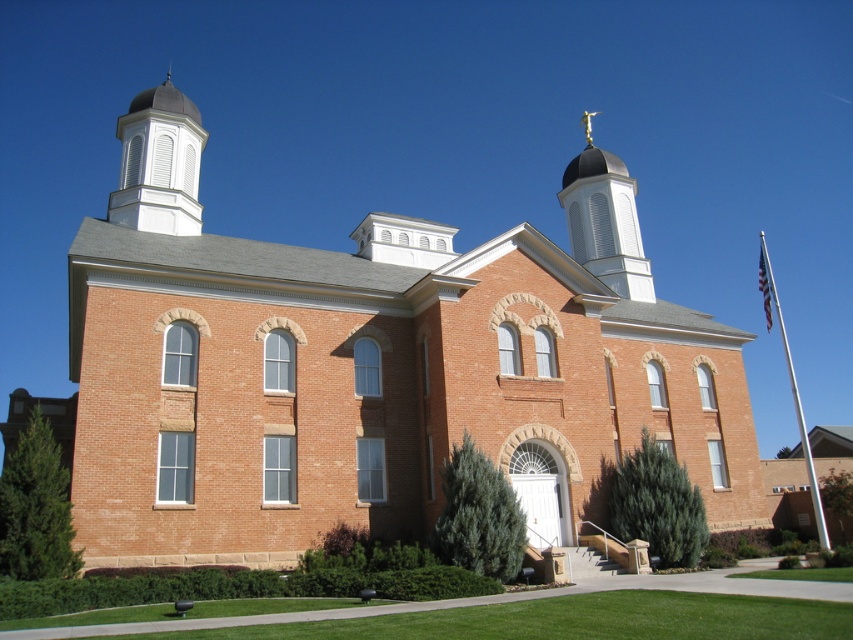
Looking at this image, can you confirm if white wood cupola at upper left is positioned above smooth white dome at upper center?

Yes.

Which is below, white wood cupola at upper left or smooth white dome at upper center?

smooth white dome at upper center is lower down.

Is point (126, 221) less distant than point (598, 176)?

Yes.

The width and height of the screenshot is (853, 640). Identify the location of white wood cupola at upper left. (x=160, y=163).

Does white wood cupola at upper left appear over white metallic flag pole at right?

Yes.

Does white wood cupola at upper left have a larger size compared to white metallic flag pole at right?

No.

This screenshot has height=640, width=853. Identify the location of white wood cupola at upper left. (160, 163).

In the scene shown: Between brick church at center and white metallic flag pole at right, which one is positioned lower?

white metallic flag pole at right is below.

Does brick church at center have a smaller size compared to white metallic flag pole at right?

Yes.

Measure the distance between brick church at center and camera.

brick church at center is 32.42 meters from camera.

What are the coordinates of `brick church at center` in the screenshot? It's located at (370, 388).